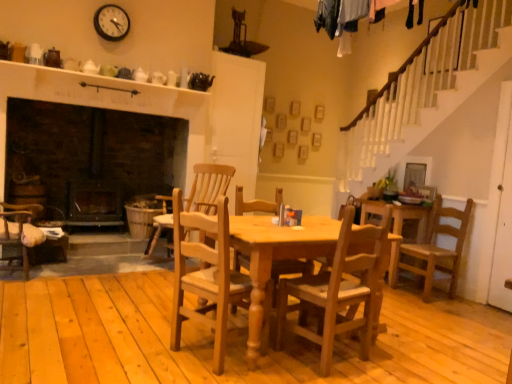
Question: Is black plastic clock at upper center inside the boundaries of light brown wooden chair at right, the 3th chair viewed from the front, or outside?

Choices:
 (A) inside
 (B) outside

Answer: (B)

Question: Considering the positions of point (108, 16) and point (458, 240), is point (108, 16) closer or farther from the camera than point (458, 240)?

Choices:
 (A) farther
 (B) closer

Answer: (A)

Question: Which object is the closest to the wooden chair at center, which ranks as the 3th chair in back-to-front order?

Choices:
 (A) black plastic clock at upper center
 (B) light brown wood chair at center, arranged as the 1th chair when viewed from the back
 (C) natural wood chair at center, marked as the third chair in a right-to-left arrangement
 (D) light brown wooden chair at right, the second chair from the back

Answer: (C)

Question: Considering the real-world distances, which object is closest to the light brown wood chair at center, acting as the fourth chair starting from the front?

Choices:
 (A) black plastic clock at upper center
 (B) wooden chair at center, placed as the third chair when sorted from left to right
 (C) natural wood chair at center, the 4th chair when ordered from back to front
 (D) light brown wooden chair at right, acting as the 1th chair starting from the right

Answer: (A)